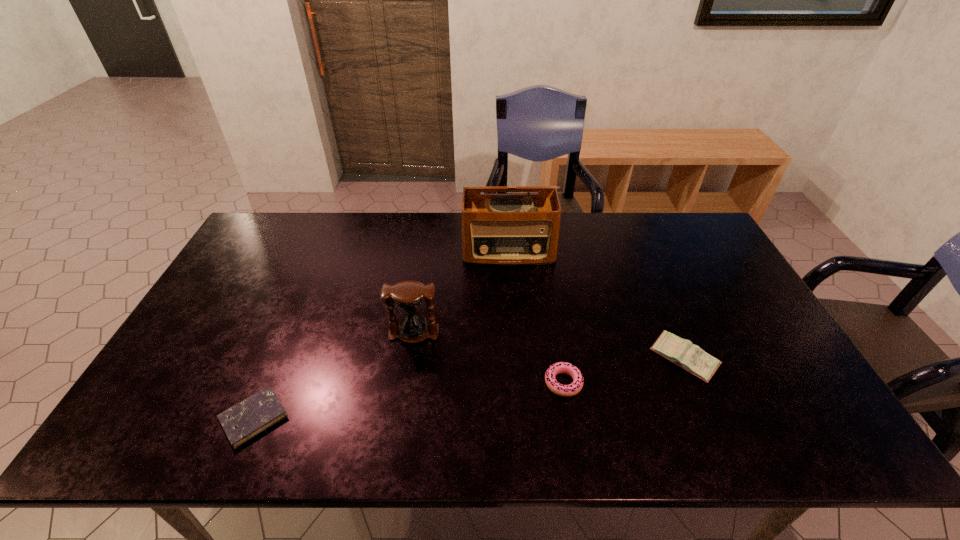
This screenshot has height=540, width=960. What are the coordinates of `vacant region at the far right corner of the desktop` in the screenshot? It's located at (701, 236).

This screenshot has height=540, width=960. I want to click on vacant space that is in between the hourglass and the second shortest object, so click(x=489, y=358).

Where is `vacant area between the taller diary and the second tallest object`? vacant area between the taller diary and the second tallest object is located at coordinates (548, 346).

The image size is (960, 540). In order to click on empty space that is in between the doughnut and the farther diary in this screenshot , I will do `click(623, 371)`.

The image size is (960, 540). I want to click on empty location between the radio receiver and the leftmost object, so click(381, 334).

Image resolution: width=960 pixels, height=540 pixels. Identify the location of empty space that is in between the doughnut and the radio receiver. [x=536, y=317].

Locate an element on the screen. free space between the hourglass and the left diary is located at coordinates (334, 375).

The height and width of the screenshot is (540, 960). Find the location of `vacant area that lies between the rightmost object and the doughnut`. vacant area that lies between the rightmost object and the doughnut is located at coordinates (623, 371).

Locate an element on the screen. This screenshot has width=960, height=540. free area in between the fourth object from right to left and the fourth tallest object is located at coordinates (489, 358).

Locate an element on the screen. The width and height of the screenshot is (960, 540). empty location between the farthest object and the shortest object is located at coordinates (381, 334).